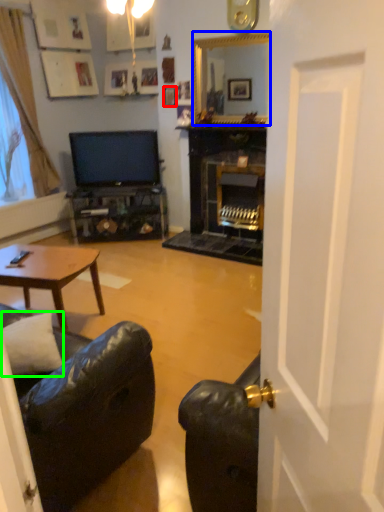
Question: Estimate the real-world distances between objects in this image. Which object is farther from picture frame (highlighted by a red box), fireplace (highlighted by a blue box) or pillow (highlighted by a green box)?

Choices:
 (A) fireplace
 (B) pillow

Answer: (B)